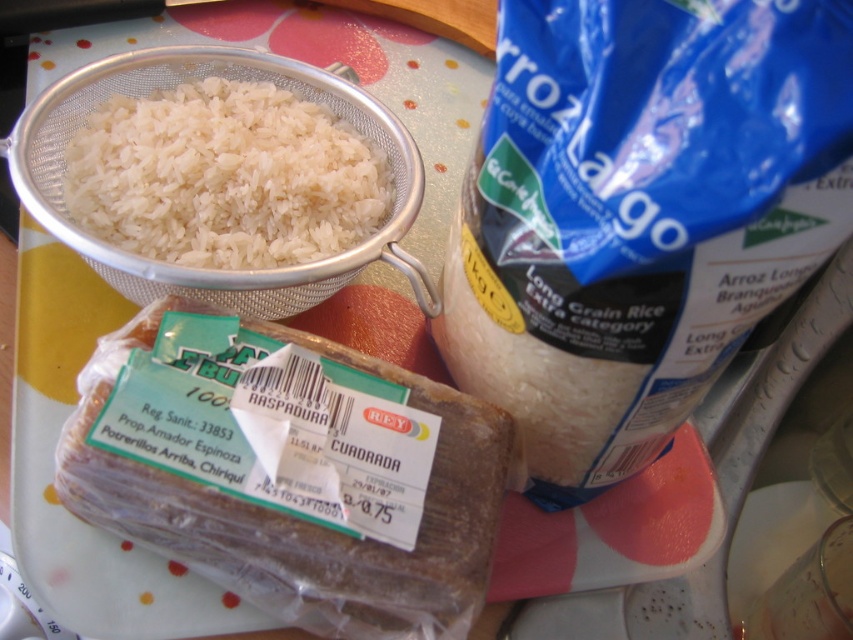
Question: Considering the relative positions of brown bread at center and white matte rice at upper left in the image provided, where is brown bread at center located with respect to white matte rice at upper left?

Choices:
 (A) right
 (B) left

Answer: (A)

Question: Which of the following is the farthest from the observer?

Choices:
 (A) white matte rice at upper left
 (B) brown bread at center

Answer: (A)

Question: Which point is closer to the camera?

Choices:
 (A) brown bread at center
 (B) white matte rice at upper left

Answer: (A)

Question: Observing the image, what is the correct spatial positioning of brown bread at center in reference to white matte rice at upper left?

Choices:
 (A) left
 (B) right

Answer: (B)

Question: Does brown bread at center appear over white matte rice at upper left?

Choices:
 (A) yes
 (B) no

Answer: (B)